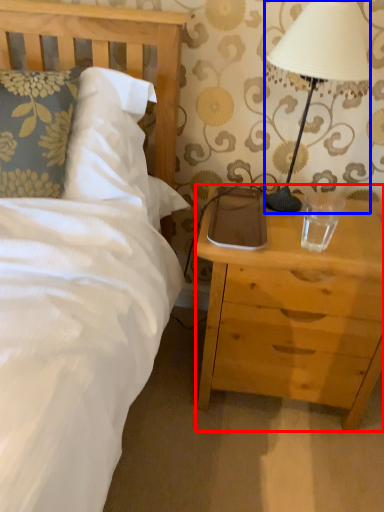
Question: Among these objects, which one is farthest to the camera, nightstand (highlighted by a red box) or lamp (highlighted by a blue box)?

Choices:
 (A) nightstand
 (B) lamp

Answer: (A)